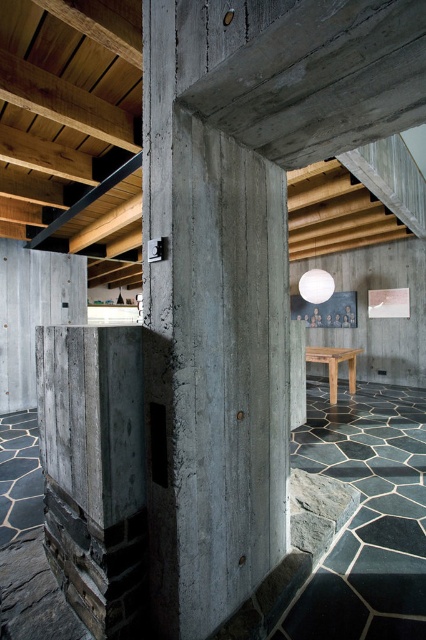
You are standing in the center of the room and want to place a new rug. The rug must be placed between the concrete at center and the wooden stool at center. Is this possible?

The concrete at center is in front of the wooden stool at center, so there is no space between them to place a rug.

You are standing in the room and want to move from the point at coordinates (132, 157) to the point at coordinates (310, 346). Which direction should you move in to reach your destination?

To move from point (132, 157) to point (310, 346), you should move towards the upper right direction since point (310, 346) is located behind point (132, 157).